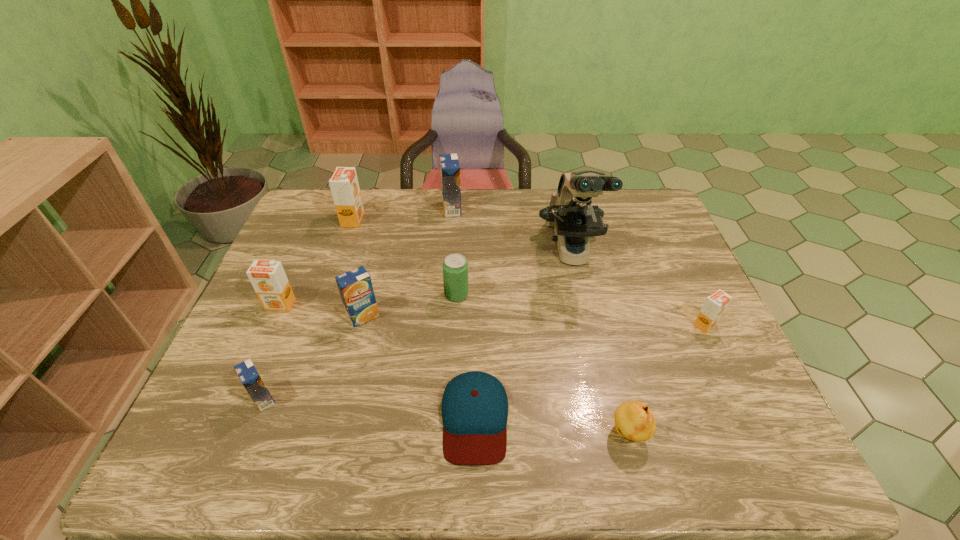
The width and height of the screenshot is (960, 540). Identify the location of vacant space situated on the front of the second nearest orange orange juice. (259, 352).

The height and width of the screenshot is (540, 960). I want to click on vacant space located 0.350m on the back of the soda, so click(461, 212).

You are a GUI agent. You are given a task and a screenshot of the screen. Output one action in this format:
    pyautogui.click(x=<x>, y=<y>)
    Task: Click on the free space located 0.400m on the back of the nearest orange juice
    
    Given the screenshot: What is the action you would take?
    pyautogui.click(x=316, y=267)

This screenshot has width=960, height=540. Identify the location of vacant space located on the back of the rightmost orange orange juice. (677, 265).

You are a GUI agent. You are given a task and a screenshot of the screen. Output one action in this format:
    pyautogui.click(x=<x>, y=<y>)
    Task: Click on the free space located 0.210m on the right of the pear
    
    Given the screenshot: What is the action you would take?
    pyautogui.click(x=749, y=433)

The image size is (960, 540). I want to click on microscope that is at the far edge, so click(570, 211).

Image resolution: width=960 pixels, height=540 pixels. I want to click on pear at the near edge, so click(634, 420).

At what (x,y) coordinates should I click in order to perform the action: click on baseball cap that is positioned at the near edge. Please return your answer as a coordinate pair (x, y). The height and width of the screenshot is (540, 960). Looking at the image, I should click on coord(474,408).

This screenshot has height=540, width=960. In order to click on object situated at the right edge in this screenshot , I will do `click(715, 305)`.

Where is `object that is at the far left corner`? The height and width of the screenshot is (540, 960). object that is at the far left corner is located at coordinates (344, 185).